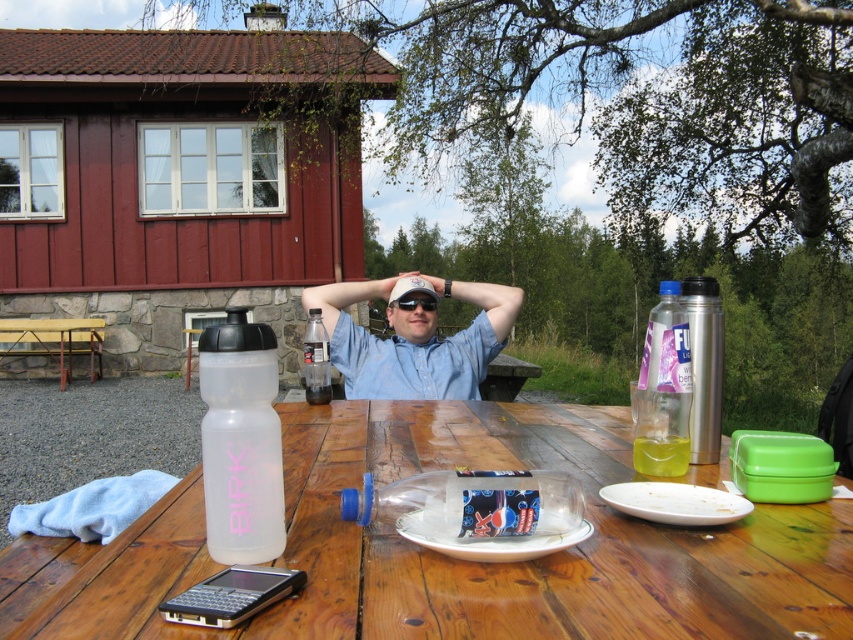
You are standing in front of the wooden table at center and want to place a napkin on the white plastic plate at center. Can you directly reach the plate without moving your position?

The wooden table at center is closer to the viewer than the white plastic plate at center, so you can reach the plate by extending your arm across the table.

You are standing at the origin point of the coordinate system. Where is the wooden table at center located?

The wooden table at center is located at point (451, 557).

You are a waiter at the picnic table and need to place a 1.5 meter long tray between the white matte plate at lower right and the clear plastic bottle at center. Can you fit it there?

The distance between the white matte plate at lower right and the clear plastic bottle at center is 1.65 meters. Since the tray is 1.5 meters long, it can fit within the available space.